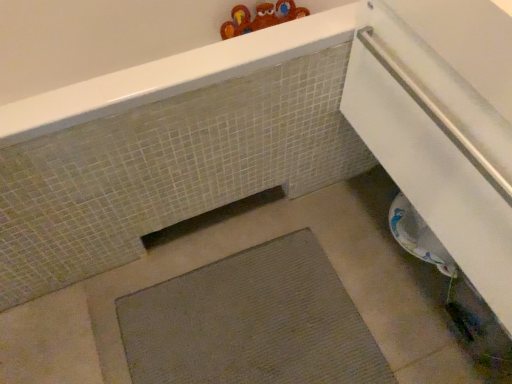
You are a GUI agent. You are given a task and a screenshot of the screen. Output one action in this format:
    pyautogui.click(x=<x>, y=<y>)
    Task: Click on the free space underneath gray textured bath mat at center (from a real-world perspective)
    The image size is (512, 384).
    Given the screenshot: What is the action you would take?
    pyautogui.click(x=248, y=326)